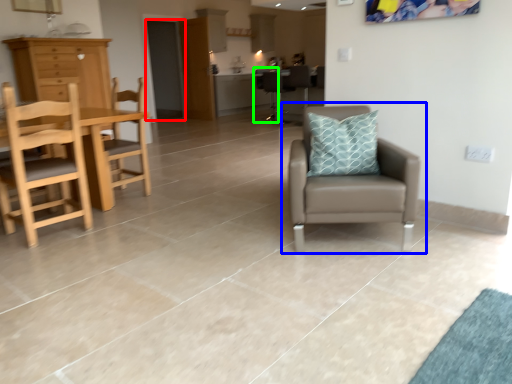
Question: Which is farther away from glass door (highlighted by a red box)? chair (highlighted by a blue box) or armchair (highlighted by a green box)?

Choices:
 (A) chair
 (B) armchair

Answer: (A)